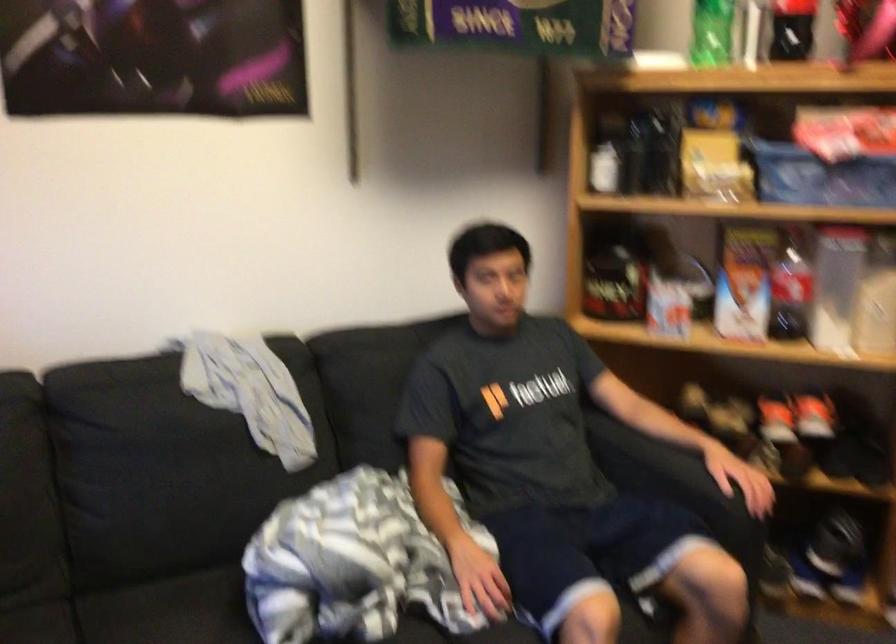
Where would you lift the clear plastic pitcher? Please return your answer as a coordinate pair (x, y).

(836, 287)